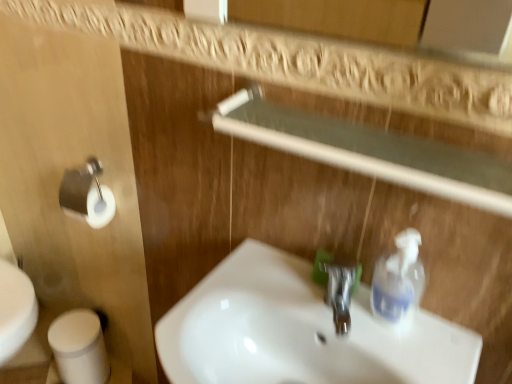
Question: Is the position of white glossy sink at center less distant than that of white matte toilet paper at lower left?

Choices:
 (A) no
 (B) yes

Answer: (B)

Question: From the image's perspective, does white glossy sink at center appear higher than white matte toilet paper at lower left?

Choices:
 (A) no
 (B) yes

Answer: (B)

Question: Does white glossy sink at center have a greater width compared to white matte toilet paper at lower left?

Choices:
 (A) no
 (B) yes

Answer: (B)

Question: From a real-world perspective, is white glossy sink at center below white matte toilet paper at lower left?

Choices:
 (A) yes
 (B) no

Answer: (B)

Question: Is the depth of white glossy sink at center greater than that of white matte toilet paper at lower left?

Choices:
 (A) no
 (B) yes

Answer: (A)

Question: Is white glossy sink at center at the right side of white matte toilet paper at lower left?

Choices:
 (A) no
 (B) yes

Answer: (B)

Question: Is the depth of white matte toilet paper at lower left greater than that of white glossy sink at center?

Choices:
 (A) no
 (B) yes

Answer: (B)

Question: Considering the relative sizes of white matte toilet paper at lower left and white glossy sink at center in the image provided, is white matte toilet paper at lower left taller than white glossy sink at center?

Choices:
 (A) yes
 (B) no

Answer: (A)

Question: Is white matte toilet paper at lower left at the right side of white glossy sink at center?

Choices:
 (A) yes
 (B) no

Answer: (B)

Question: From the image's perspective, would you say white matte toilet paper at lower left is shown under white glossy sink at center?

Choices:
 (A) yes
 (B) no

Answer: (A)

Question: From the image's perspective, would you say white matte toilet paper at lower left is positioned over white glossy sink at center?

Choices:
 (A) yes
 (B) no

Answer: (B)

Question: Does white matte toilet paper at lower left have a lesser width compared to white glossy sink at center?

Choices:
 (A) yes
 (B) no

Answer: (A)

Question: Can you confirm if clear plastic soap dispenser at right is wider than polished chrome faucet at center?

Choices:
 (A) no
 (B) yes

Answer: (B)